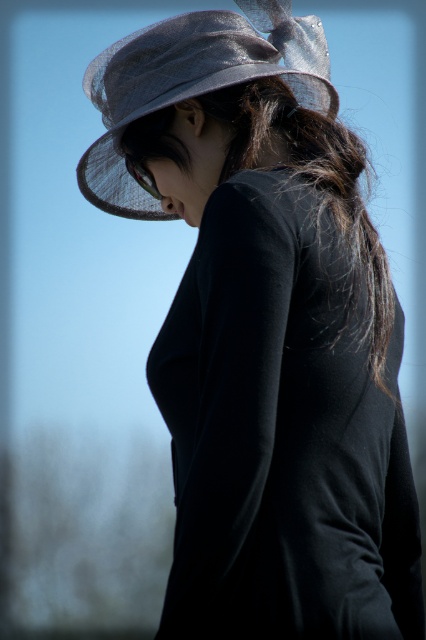
Question: Which point is closer to the camera?

Choices:
 (A) (233, 36)
 (B) (331, 289)

Answer: (B)

Question: Does black silky hair at center appear over satin-like gray hat at upper center?

Choices:
 (A) no
 (B) yes

Answer: (A)

Question: Does black silky hair at center appear over satin-like gray hat at upper center?

Choices:
 (A) yes
 (B) no

Answer: (B)

Question: Is black silky hair at center positioned before satin-like gray hat at upper center?

Choices:
 (A) no
 (B) yes

Answer: (B)